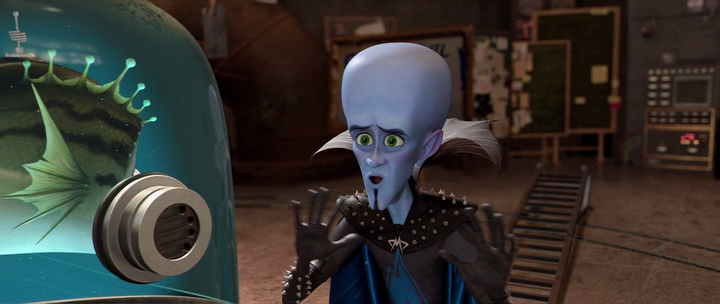
Identify the location of computer. (672, 108).